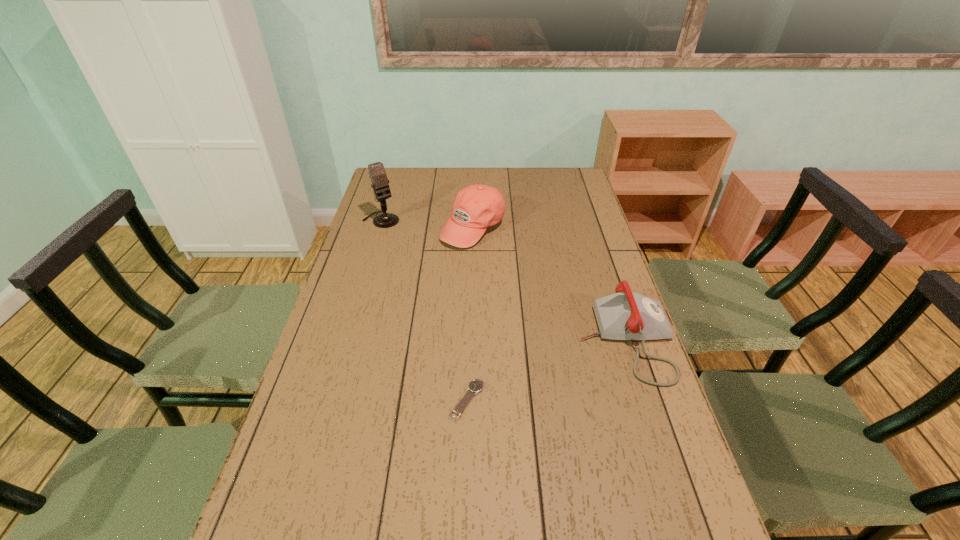
The width and height of the screenshot is (960, 540). Find the location of `free space at the near right corner of the desktop`. free space at the near right corner of the desktop is located at coordinates (654, 515).

Image resolution: width=960 pixels, height=540 pixels. Find the location of `empty space that is in between the watch and the baseball cap`. empty space that is in between the watch and the baseball cap is located at coordinates (469, 314).

Locate an element on the screen. This screenshot has height=540, width=960. vacant area that lies between the rightmost object and the second tallest object is located at coordinates (549, 285).

Where is `free space between the microphone and the rightmost object`? This screenshot has height=540, width=960. free space between the microphone and the rightmost object is located at coordinates (504, 280).

Locate an element on the screen. The height and width of the screenshot is (540, 960). free space between the second shortest object and the baseball cap is located at coordinates (549, 285).

The height and width of the screenshot is (540, 960). Find the location of `vacant point located between the tallest object and the third shortest object`. vacant point located between the tallest object and the third shortest object is located at coordinates (x=427, y=224).

I want to click on vacant space that's between the second shortest object and the leftmost object, so click(x=504, y=280).

I want to click on free point between the second shortest object and the leftmost object, so click(504, 280).

Find the location of `unoccupied position between the microphone and the watch`. unoccupied position between the microphone and the watch is located at coordinates (424, 310).

Locate an element on the screen. The height and width of the screenshot is (540, 960). vacant space that is in between the microphone and the third shortest object is located at coordinates (427, 224).